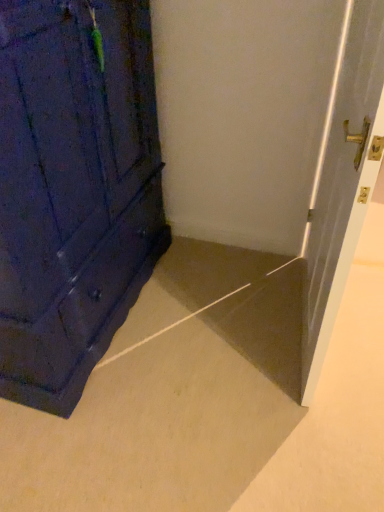
Measure the distance between satin silver door at right and camera.

satin silver door at right and camera are 83.33 centimeters apart.

The image size is (384, 512). What do you see at coordinates (343, 178) in the screenshot?
I see `satin silver door at right` at bounding box center [343, 178].

In the scene shown: In order to face satin silver door at right, should I rotate leftwards or rightwards?

You should rotate right by 18.240 degrees.

Locate an element on the screen. This screenshot has width=384, height=512. satin silver door at right is located at coordinates (343, 178).

Image resolution: width=384 pixels, height=512 pixels. In order to click on satin silver door at right in this screenshot , I will do `click(343, 178)`.